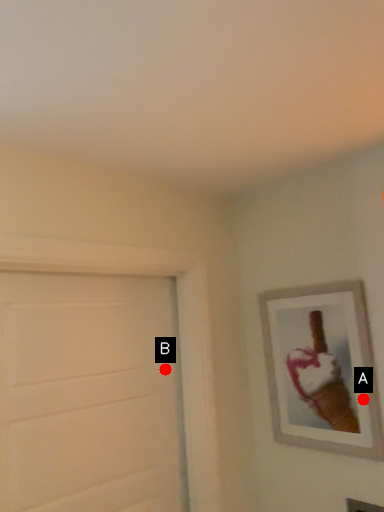
Question: Two points are circled on the image, labeled by A and B beside each circle. Which point appears farthest from the camera in this image?

Choices:
 (A) A is further
 (B) B is further

Answer: (B)